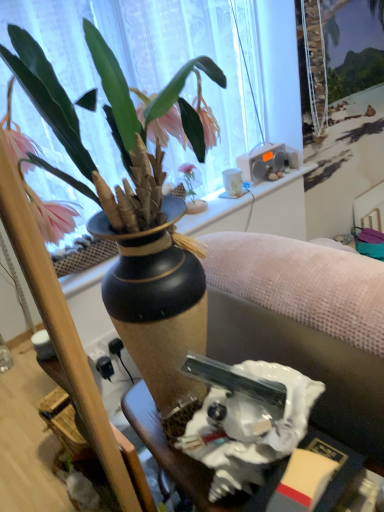
Question: Could you tell me if white glossy statue at lower center is turned towards pink matte vase at upper center?

Choices:
 (A) yes
 (B) no

Answer: (B)

Question: Is white glossy statue at lower center taller than pink matte vase at upper center?

Choices:
 (A) yes
 (B) no

Answer: (B)

Question: Is white glossy statue at lower center not near pink matte vase at upper center?

Choices:
 (A) yes
 (B) no

Answer: (B)

Question: From the image's perspective, is white glossy statue at lower center located above pink matte vase at upper center?

Choices:
 (A) no
 (B) yes

Answer: (A)

Question: Is white glossy statue at lower center oriented away from pink matte vase at upper center?

Choices:
 (A) no
 (B) yes

Answer: (A)

Question: Is white glossy statue at lower center at the right side of pink matte vase at upper center?

Choices:
 (A) yes
 (B) no

Answer: (A)

Question: Is pink matte vase at upper center positioned in front of white plastic speaker at upper right?

Choices:
 (A) yes
 (B) no

Answer: (A)

Question: From a real-world perspective, is pink matte vase at upper center over white plastic speaker at upper right?

Choices:
 (A) no
 (B) yes

Answer: (B)

Question: From the image's perspective, is pink matte vase at upper center on top of white plastic speaker at upper right?

Choices:
 (A) yes
 (B) no

Answer: (B)

Question: Is pink matte vase at upper center at the right side of white plastic speaker at upper right?

Choices:
 (A) no
 (B) yes

Answer: (A)

Question: Is pink matte vase at upper center facing away from white plastic speaker at upper right?

Choices:
 (A) no
 (B) yes

Answer: (A)

Question: Is pink matte vase at upper center facing towards white plastic speaker at upper right?

Choices:
 (A) no
 (B) yes

Answer: (A)

Question: Is matte black vase at upper center completely or partially outside of pink matte vase at upper center?

Choices:
 (A) yes
 (B) no

Answer: (A)